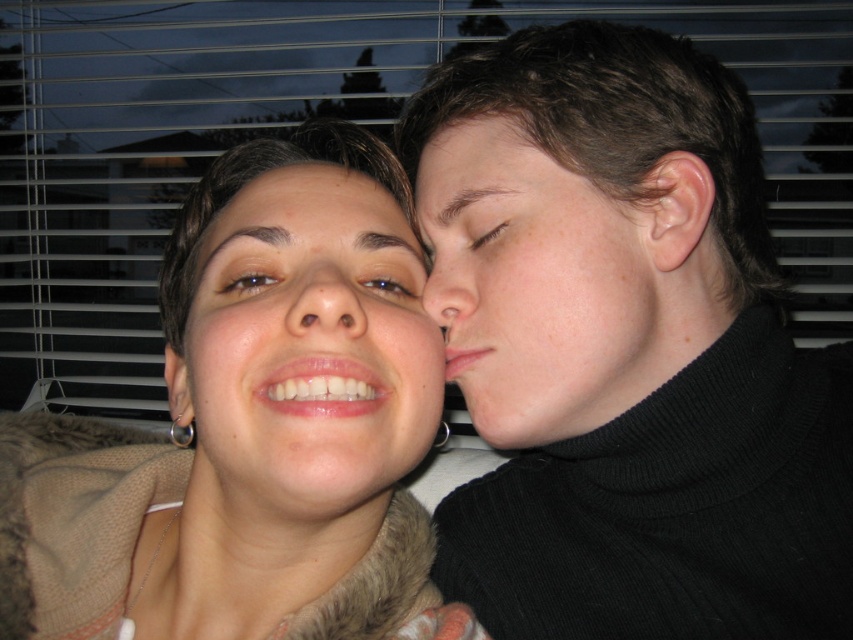
Is point (498, 401) more distant than point (344, 326)?

Yes.

Can you confirm if black turtleneck sweater at right is positioned below matte skin nose at center?

Indeed, black turtleneck sweater at right is positioned under matte skin nose at center.

Identify the location of black turtleneck sweater at right. This screenshot has height=640, width=853. (628, 352).

Identify the location of black turtleneck sweater at right. (628, 352).

Is black turtleneck sweater at right smaller than smooth skin face at right?

Actually, black turtleneck sweater at right might be larger than smooth skin face at right.

Is black turtleneck sweater at right closer to camera compared to smooth skin face at right?

Yes, black turtleneck sweater at right is in front of smooth skin face at right.

This screenshot has width=853, height=640. In order to click on black turtleneck sweater at right in this screenshot , I will do coord(628,352).

Locate an element on the screen. black turtleneck sweater at right is located at coordinates (628, 352).

Between matte skin forehead at center and blue glossy eye at upper center, which one is positioned lower?

blue glossy eye at upper center

Between matte skin forehead at center and blue glossy eye at upper center, which one appears on the left side from the viewer's perspective?

Positioned to the left is matte skin forehead at center.

What do you see at coordinates (310, 176) in the screenshot?
I see `matte skin forehead at center` at bounding box center [310, 176].

You are a GUI agent. You are given a task and a screenshot of the screen. Output one action in this format:
    pyautogui.click(x=<x>, y=<y>)
    Task: Click on the matte skin forehead at center
    
    Given the screenshot: What is the action you would take?
    pyautogui.click(x=310, y=176)